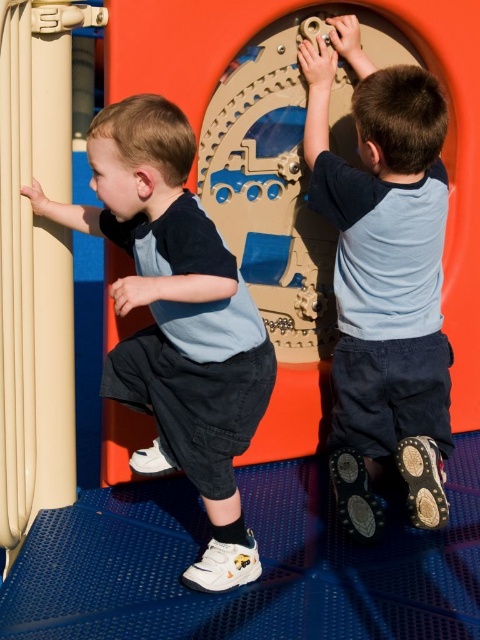
Looking at this image, you are a photographer trying to capture both the matte blue shirt at left and the smooth orange slide at center in a single frame. Based on their sizes in the image, which object should you focus on first to ensure both are in the frame?

The matte blue shirt at left occupies less space than the smooth orange slide at center, so you should focus on the smooth orange slide at center first to ensure both are in the frame.